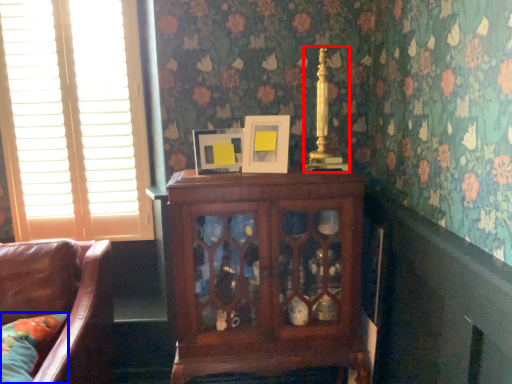
Question: Among these objects, which one is nearest to the camera, candle holder (highlighted by a red box) or pillow (highlighted by a blue box)?

Choices:
 (A) candle holder
 (B) pillow

Answer: (B)